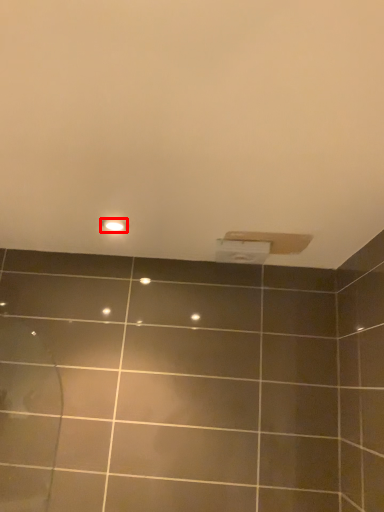
Question: Observing the image, what is the correct spatial positioning of light fixture (annotated by the red box) in reference to toilet paper?

Choices:
 (A) left
 (B) right

Answer: (A)